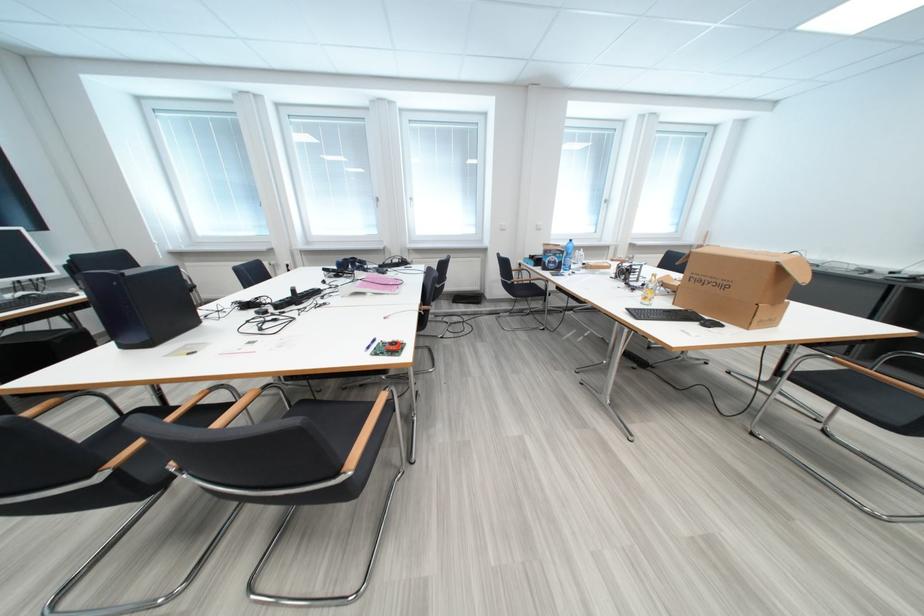
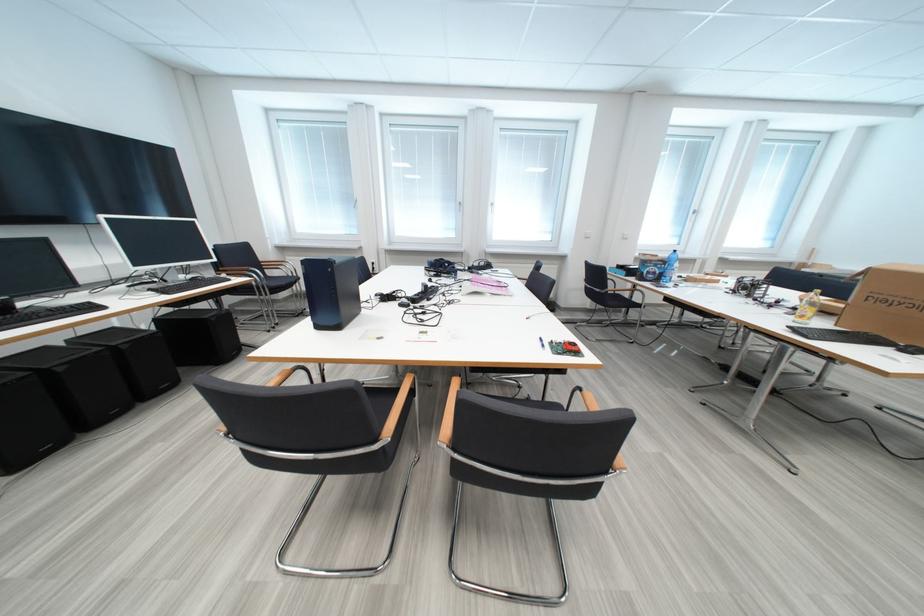
Question: The images are taken continuously from a first-person perspective. In which direction is your viewpoint rotating?

Choices:
 (A) Left
 (B) Right
 (C) Up
 (D) Down

Answer: (A)